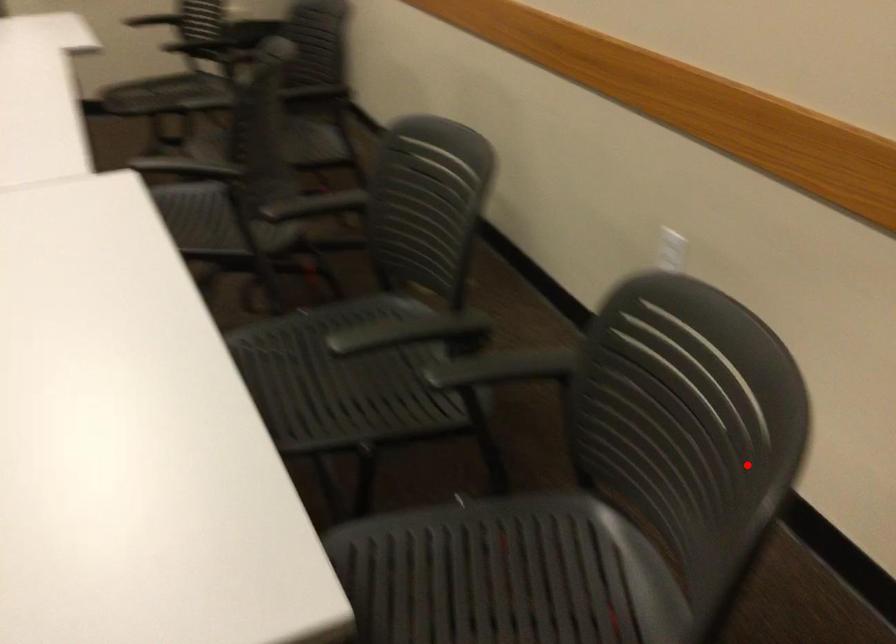
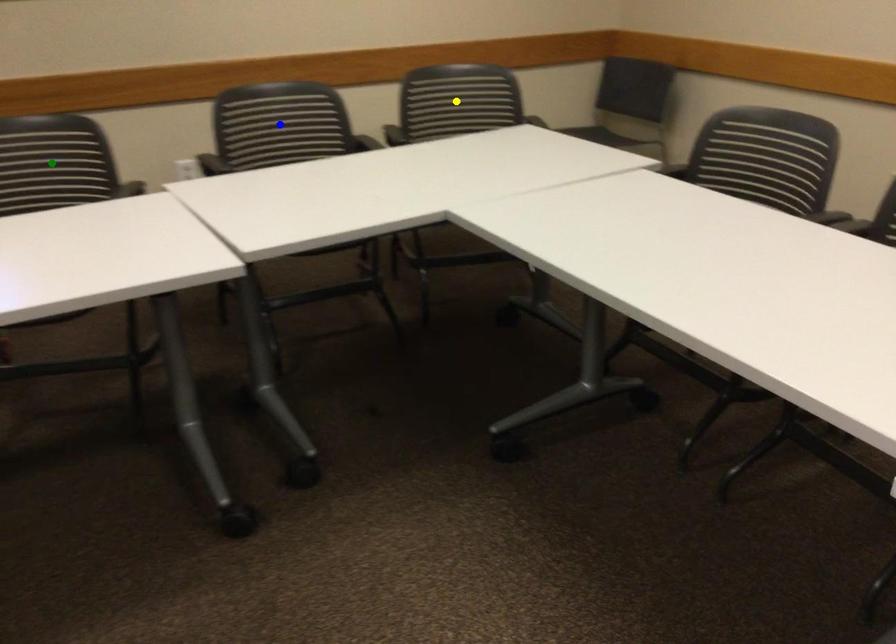
Question: I am providing you with two images of the same scene from different viewpoints. A red point is marked on the first image. You are given multiple points on the second image. Which mark in image 2 goes with the point in image 1?

Choices:
 (A) green point
 (B) yellow point
 (C) blue point

Answer: (B)